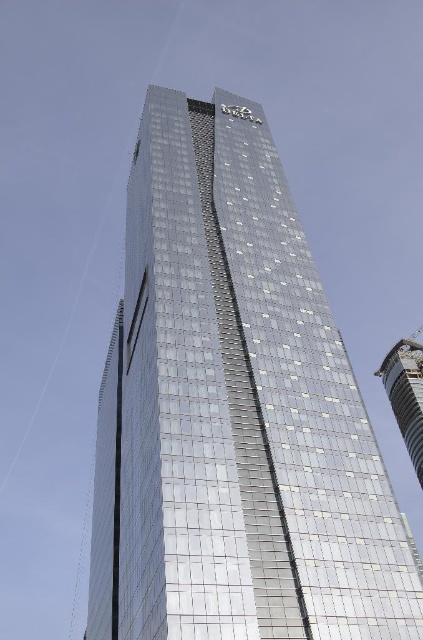
You are standing at the base of the shiny glass tower at center. If you want to take a photo of the entire building without any distortion, how far back should you move from the tower?

To capture the entire shiny glass tower at center without distortion, you should move back to a distance of 135.26 feet from the tower, as this is the recommended distance to ensure the building fits within the camera frame without any distortion.